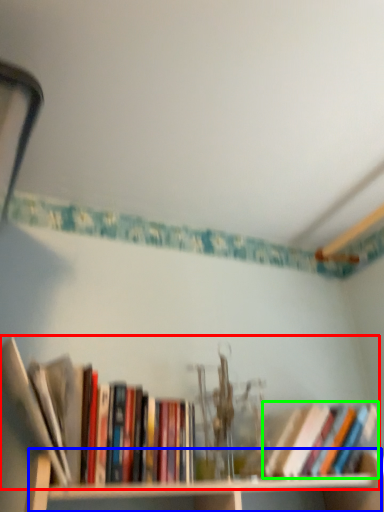
Question: Considering the real-world distances, which object is closest to book (highlighted by a red box)? cabinet (highlighted by a blue box) or book (highlighted by a green box).

Choices:
 (A) cabinet
 (B) book

Answer: (A)